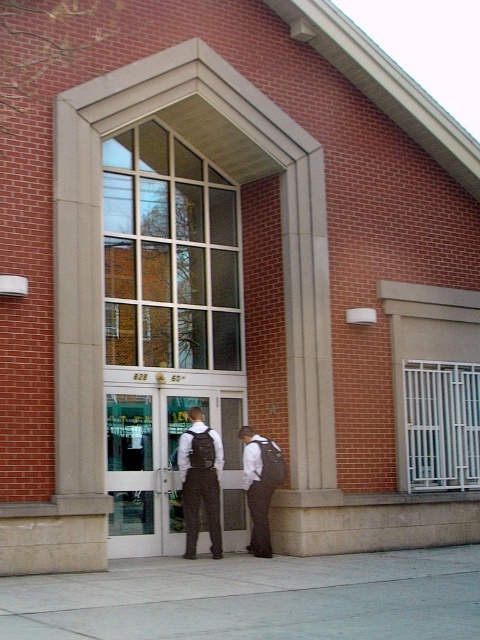
You are a visitor approaching the entrance of the building and need to pass between the two individuals wearing dark brown fabric vest at center and dark gray fabric vest at center. The width of your wheelchair is 75 centimeters. Can you safely navigate through the space between them?

The distance between the dark brown fabric vest at center and dark gray fabric vest at center is 76.33 centimeters. Since your wheelchair is 75 centimeters wide, you can safely navigate through the space between them as there is enough clearance.

Consider the image. You are a visitor approaching the entrance of the brick building. You notice two staff members wearing dark brown fabric vest at center and dark gray fabric vest at center. Which staff member is standing closer to the entrance doors?

The dark brown fabric vest at center is located below the dark gray fabric vest at center, meaning the dark brown fabric vest at center is closer to the entrance doors.